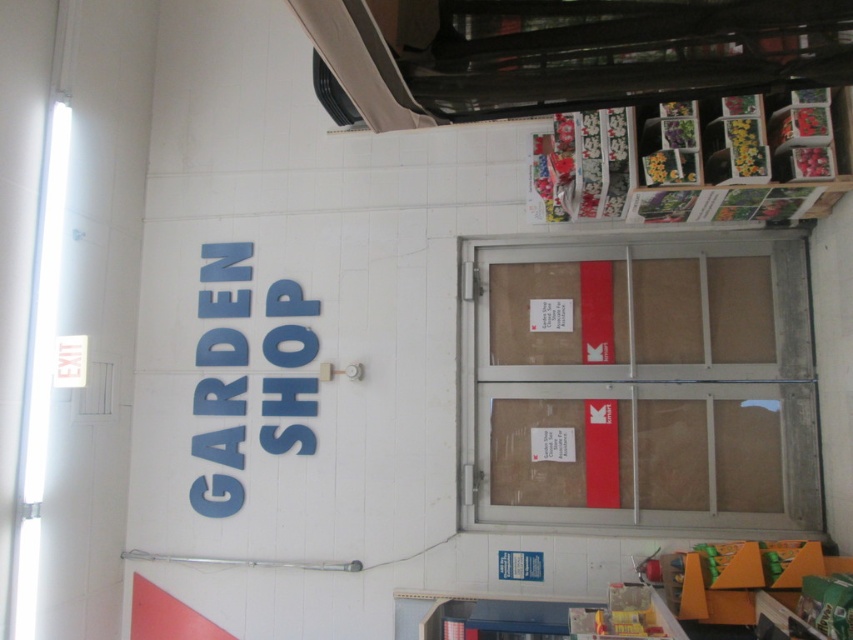
Question: Is brown cardboard door at center behind black plastic exhaust hood at upper center?

Choices:
 (A) no
 (B) yes

Answer: (B)

Question: Which object is the farthest from the brown cardboard door at center?

Choices:
 (A) wooden shelves at upper right
 (B) black plastic exhaust hood at upper center

Answer: (B)

Question: Does brown cardboard door at center have a greater width compared to blue plastic sign at upper left?

Choices:
 (A) no
 (B) yes

Answer: (B)

Question: Among these objects, which one is nearest to the camera?

Choices:
 (A) blue plastic sign at upper left
 (B) brown cardboard door at center

Answer: (B)

Question: Among these points, which one is farthest from the camera?

Choices:
 (A) (263, 406)
 (B) (318, 10)
 (C) (786, 216)
 (D) (554, 365)

Answer: (A)

Question: Can you confirm if black plastic exhaust hood at upper center is positioned above wooden shelves at upper right?

Choices:
 (A) no
 (B) yes

Answer: (B)